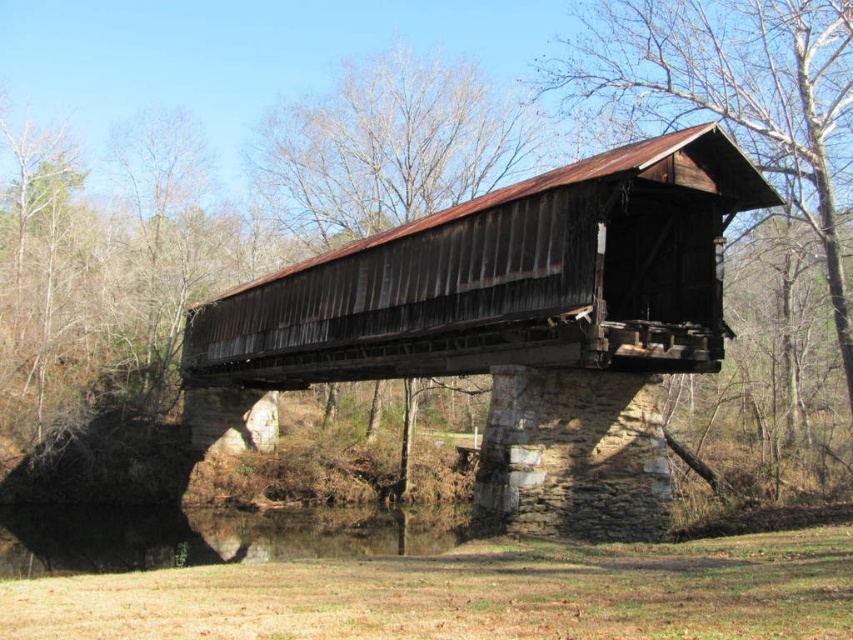
Is point (712, 161) positioned behind point (265, 550)?

No, (712, 161) is closer to viewer.

Which is in front, point (207, 304) or point (335, 518)?

Point (335, 518) is more forward.

Is point (708, 298) farther from camera compared to point (35, 573)?

No.

Where is `rusty metal bridge at center`? rusty metal bridge at center is located at coordinates (515, 323).